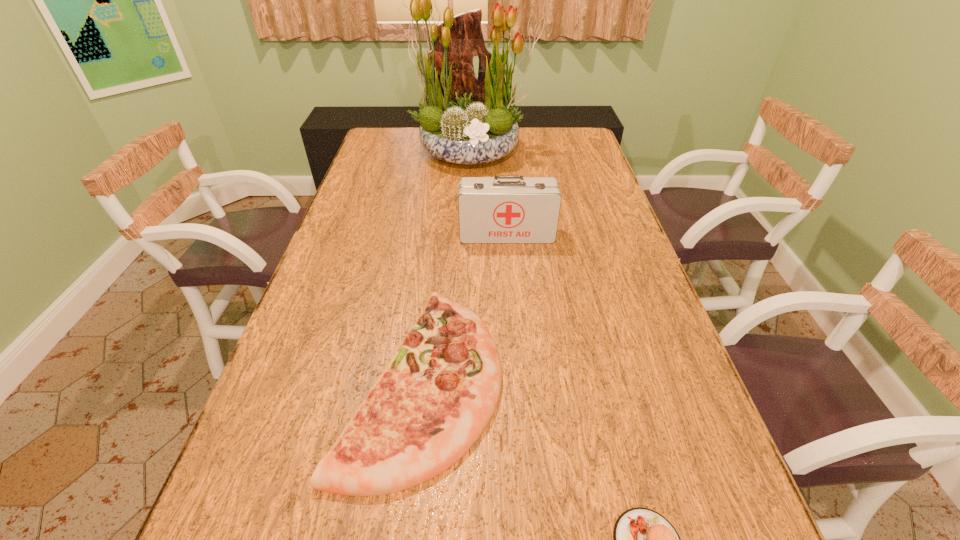
At what (x,y) coordinates should I click in order to perform the action: click on the farthest object. Please return your answer as a coordinate pair (x, y). This screenshot has height=540, width=960. Looking at the image, I should click on (465, 119).

At what (x,y) coordinates should I click in order to perform the action: click on flower arrangement. Please return your answer as a coordinate pair (x, y). Looking at the image, I should click on (465, 119).

Find the location of a particular element. The width and height of the screenshot is (960, 540). the first-aid kit is located at coordinates (502, 209).

Identify the location of the third nearest object. The width and height of the screenshot is (960, 540). (502, 209).

Locate an element on the screen. Image resolution: width=960 pixels, height=540 pixels. pizza is located at coordinates (440, 390).

Find the location of `blank space located on the front-facing side of the flower arrangement`. blank space located on the front-facing side of the flower arrangement is located at coordinates 470,204.

This screenshot has width=960, height=540. I want to click on blank space located 0.300m on the front-facing side of the third nearest object, so (x=514, y=321).

At what (x,y) coordinates should I click in order to perform the action: click on vacant space situated 0.230m on the back of the pizza. Please return your answer as a coordinate pair (x, y). Looking at the image, I should click on [438, 242].

Locate an element on the screen. object located at the far edge is located at coordinates (465, 119).

Where is `object that is positioned at the left edge`? object that is positioned at the left edge is located at coordinates (440, 390).